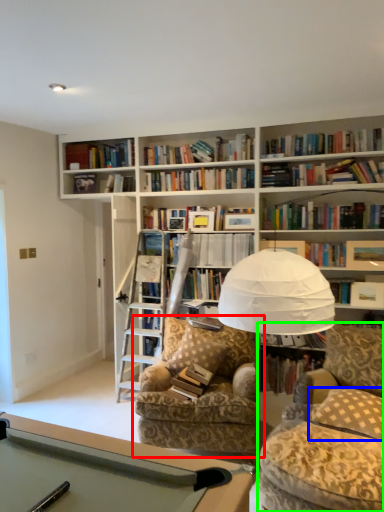
Question: Considering the real-world distances, which object is farthest from chair (highlighted by a red box)? pillow (highlighted by a blue box) or swivel chair (highlighted by a green box)?

Choices:
 (A) pillow
 (B) swivel chair

Answer: (A)